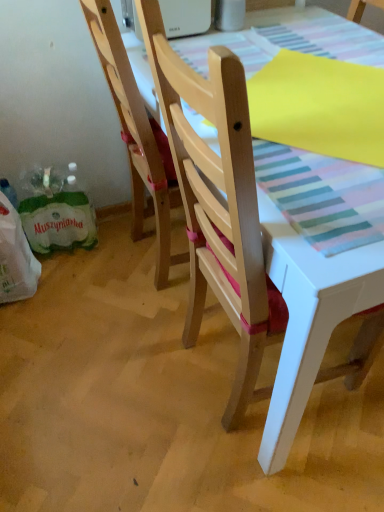
I want to click on vacant region to the right of green paper shopping bag at lower left, so click(112, 253).